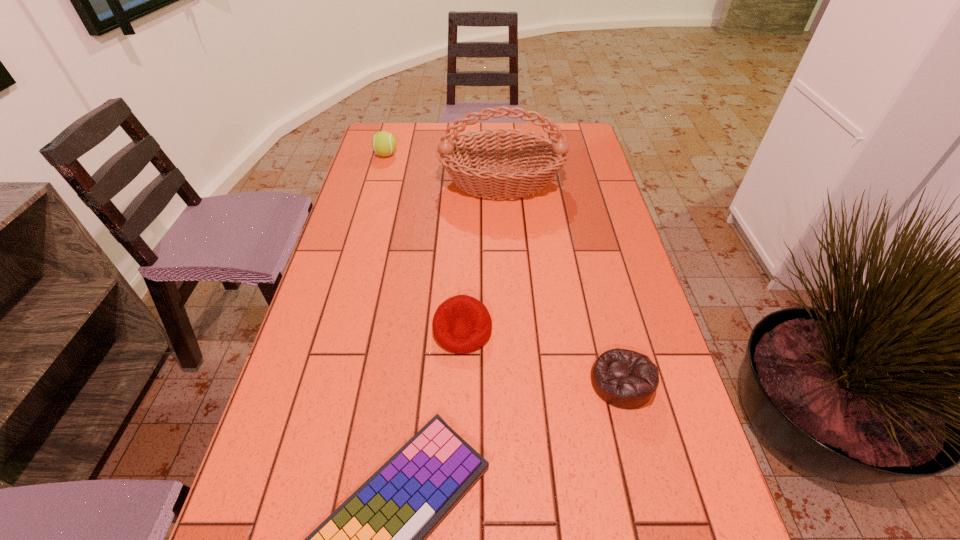
Identify the location of basket. (544, 157).

Find the location of `tennis ball`. tennis ball is located at coordinates (384, 143).

Locate an element on the screen. the left beanbag is located at coordinates (462, 324).

Where is `the shorter beanbag`? the shorter beanbag is located at coordinates (626, 379).

This screenshot has height=540, width=960. What are the coordinates of `the second shortest object` in the screenshot? It's located at (626, 379).

Locate an element on the screen. This screenshot has width=960, height=540. free space located 0.220m on the front of the basket is located at coordinates (506, 259).

Locate an element on the screen. free location located on the front of the tennis ball is located at coordinates (373, 200).

Locate an element on the screen. free space located on the seat area of the taller beanbag is located at coordinates (459, 438).

You are a GUI agent. You are given a task and a screenshot of the screen. Output one action in this format:
    pyautogui.click(x=<x>, y=<y>)
    Task: Click on the vacant space situated on the back of the shorter beanbag
    This screenshot has width=960, height=540.
    Given the screenshot: What is the action you would take?
    pyautogui.click(x=600, y=294)

Identify the location of object situated at the far edge. The height and width of the screenshot is (540, 960). (384, 143).